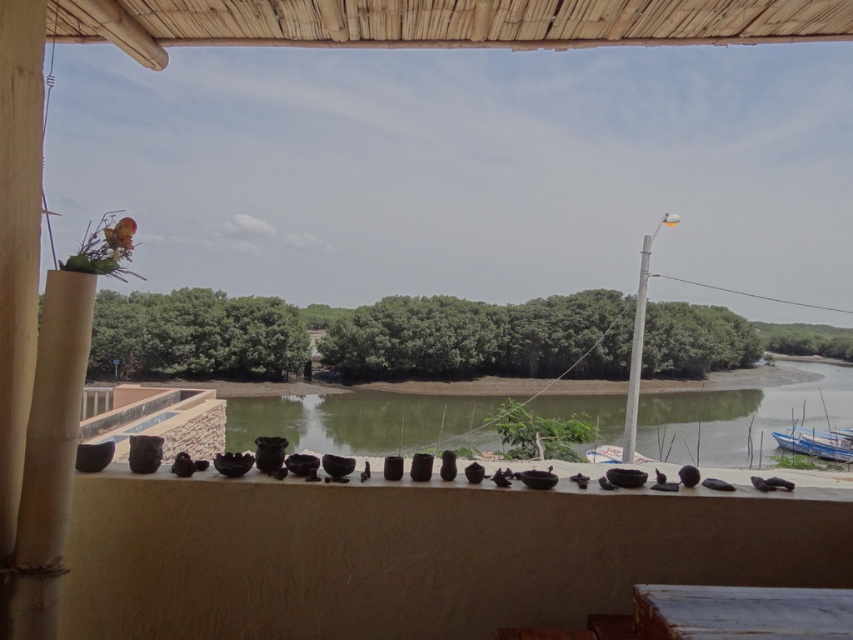
Does matte black bowls at center have a greater width compared to blue painted wood boat at lower right?

Incorrect, matte black bowls at center's width does not surpass blue painted wood boat at lower right's.

Is matte black bowls at center in front of blue painted wood boat at lower right?

Yes, it is.

Describe the element at coordinates (419, 552) in the screenshot. I see `matte black bowls at center` at that location.

The width and height of the screenshot is (853, 640). I want to click on matte black bowls at center, so click(419, 552).